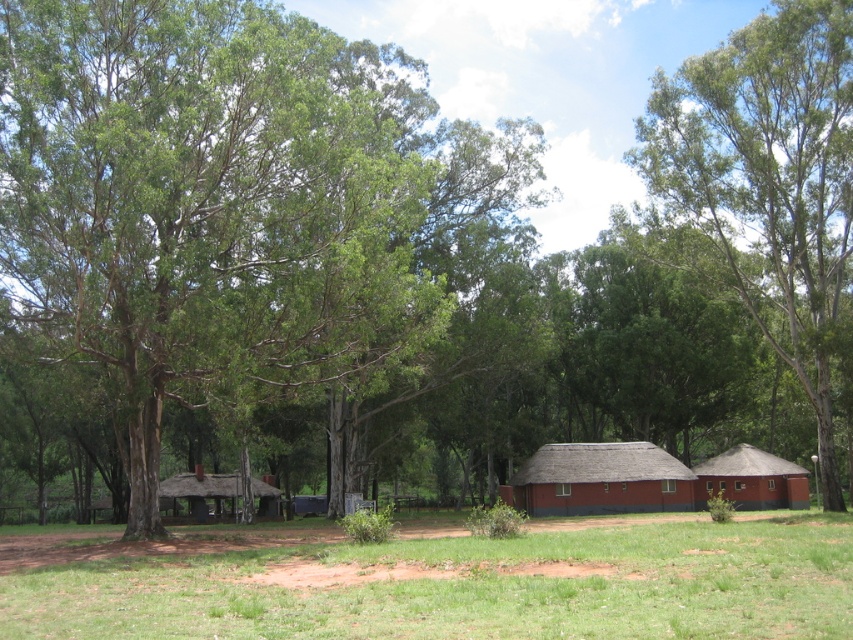
Question: Among these objects, which one is farthest from the camera?

Choices:
 (A) red thatched hut at center
 (B) thatched red hut at right

Answer: (B)

Question: Considering the relative positions of green grass at lower center and red thatched hut at center in the image provided, where is green grass at lower center located with respect to red thatched hut at center?

Choices:
 (A) right
 (B) left

Answer: (B)

Question: Does red thatched hut at center have a larger size compared to thatched straw hut at center?

Choices:
 (A) yes
 (B) no

Answer: (A)

Question: Based on their relative distances, which object is nearer to the green leafy tree at upper right?

Choices:
 (A) thatched red hut at right
 (B) red thatched hut at center

Answer: (A)

Question: Which point appears farthest from the camera in this image?

Choices:
 (A) (817, 177)
 (B) (646, 496)
 (C) (576, 579)
 (D) (755, 502)

Answer: (D)

Question: Considering the relative positions of green grass at lower center and thatched straw hut at center in the image provided, where is green grass at lower center located with respect to thatched straw hut at center?

Choices:
 (A) above
 (B) below

Answer: (A)